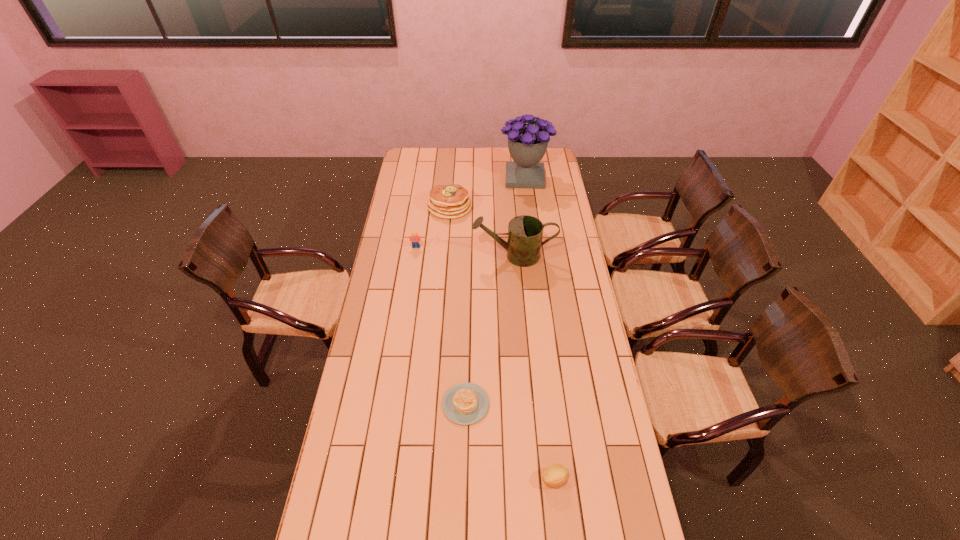
Image resolution: width=960 pixels, height=540 pixels. I want to click on vacant position located on the left of the tallest object, so click(x=442, y=178).

At what (x,y) coordinates should I click in order to perform the action: click on free location located 0.130m with the spout on the fifth shortest object. Please return your answer as a coordinate pair (x, y). The height and width of the screenshot is (540, 960). Looking at the image, I should click on (445, 255).

The image size is (960, 540). I want to click on free location located 0.330m with the spout on the fifth shortest object, so click(402, 255).

Locate an element on the screen. The image size is (960, 540). vacant space located with the spout on the fifth shortest object is located at coordinates (409, 255).

This screenshot has height=540, width=960. In order to click on free region located on the right of the taller pancake in this screenshot , I will do `click(516, 207)`.

Find the location of a particular element. This screenshot has width=960, height=540. free space located 0.250m on the face of the third shortest object is located at coordinates (410, 288).

At what (x,y) coordinates should I click in order to perform the action: click on vacant space located 0.250m at the stem end of the nearest object. Please return your answer as a coordinate pair (x, y). The height and width of the screenshot is (540, 960). Looking at the image, I should click on (460, 479).

The image size is (960, 540). Identify the location of vacant area located 0.070m at the stem end of the nearest object. (517, 479).

Image resolution: width=960 pixels, height=540 pixels. What are the coordinates of `free location located at the stem end of the nearest object` in the screenshot? It's located at (441, 479).

The height and width of the screenshot is (540, 960). In order to click on vacant space located on the right of the shorter pancake in this screenshot , I will do `click(532, 404)`.